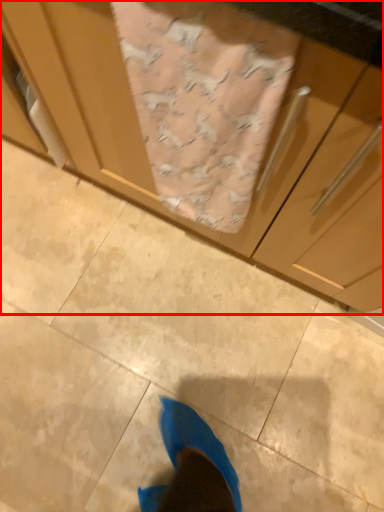
Question: From the image's perspective, what is the correct spatial positioning of cabinetry (annotated by the red box) in reference to blanket?

Choices:
 (A) above
 (B) below

Answer: (A)